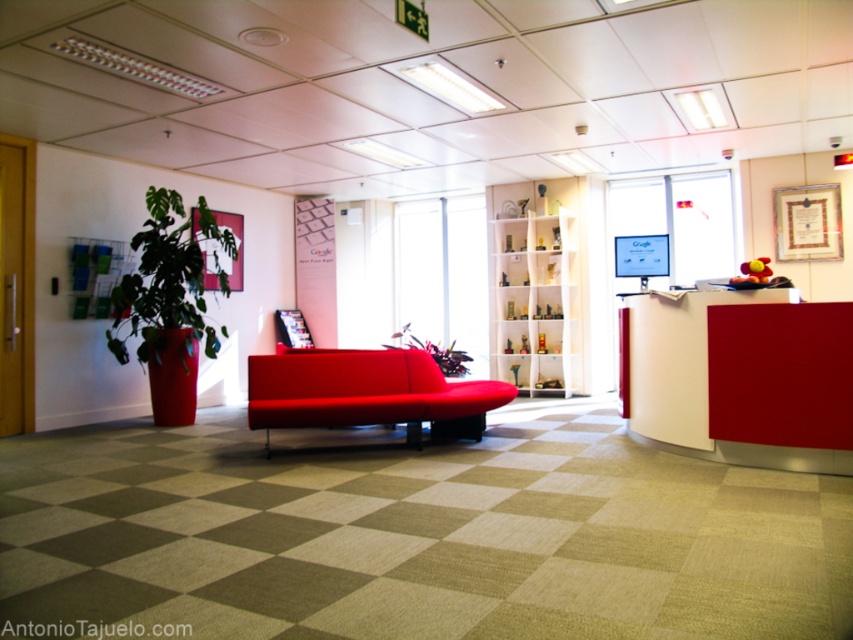
Which of these two, matte red couch at center or green matte plant at left, stands shorter?

matte red couch at center is shorter.

Consider the image. Who is more forward, (x=366, y=381) or (x=190, y=244)?

Point (x=366, y=381) is in front.

Where is `matte red couch at center`? The height and width of the screenshot is (640, 853). matte red couch at center is located at coordinates (367, 392).

Does green matte plant at left have a greater width compared to green matte plant at center?

Indeed, green matte plant at left has a greater width compared to green matte plant at center.

In the scene shown: Is green matte plant at left to the left of green matte plant at center from the viewer's perspective?

Indeed, green matte plant at left is positioned on the left side of green matte plant at center.

I want to click on green matte plant at left, so click(169, 280).

In the scene shown: Is matte red couch at center smaller than green matte plant at center?

Actually, matte red couch at center might be larger than green matte plant at center.

Who is shorter, matte red couch at center or green matte plant at center?

With less height is green matte plant at center.

Where is `matte red couch at center`? Image resolution: width=853 pixels, height=640 pixels. matte red couch at center is located at coordinates (367, 392).

Locate an element on the screen. This screenshot has width=853, height=640. matte red couch at center is located at coordinates click(x=367, y=392).